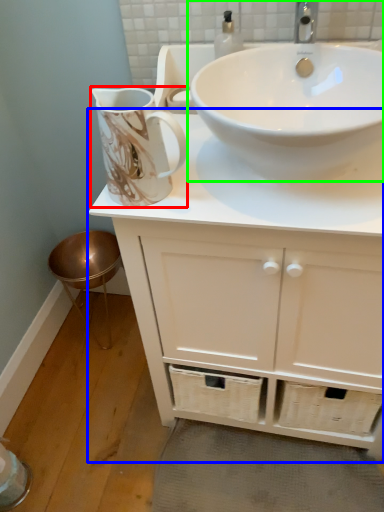
Question: Considering the real-world distances, which object is closest to jug (highlighted by a red box)? bathroom cabinet (highlighted by a blue box) or sink (highlighted by a green box).

Choices:
 (A) bathroom cabinet
 (B) sink

Answer: (B)